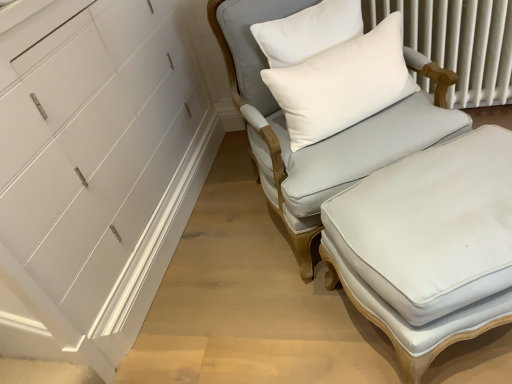
You are a GUI agent. You are given a task and a screenshot of the screen. Output one action in this format:
    pyautogui.click(x=<x>, y=<y>)
    Task: Click on the vacant point to the left of white fabric ottoman at center
    
    Given the screenshot: What is the action you would take?
    pyautogui.click(x=280, y=313)